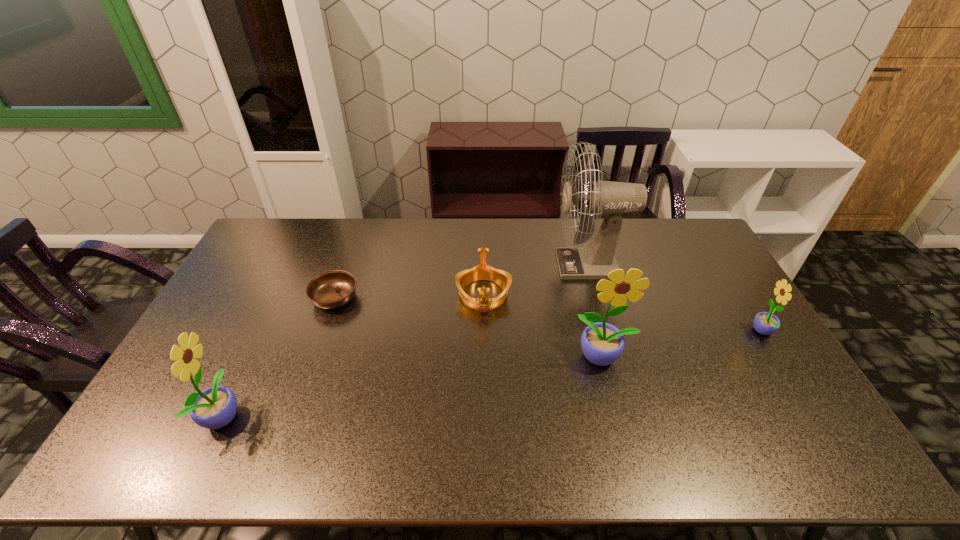
Where is `object that is at the far edge`? This screenshot has width=960, height=540. object that is at the far edge is located at coordinates (612, 199).

Locate an element on the screen. This screenshot has width=960, height=540. object that is at the near edge is located at coordinates (215, 407).

What are the coordinates of `object that is at the left edge` in the screenshot? It's located at (215, 407).

Where is `object present at the right edge`? object present at the right edge is located at coordinates (765, 323).

At what (x,y) coordinates should I click in order to perform the action: click on object located at the near left corner. Please return your answer as a coordinate pair (x, y). The height and width of the screenshot is (540, 960). Looking at the image, I should click on (215, 407).

You are a GUI agent. You are given a task and a screenshot of the screen. Output one action in this format:
    pyautogui.click(x=<x>, y=<y>)
    Task: Click on the free space at the far edge
    This screenshot has width=960, height=540.
    Given the screenshot: What is the action you would take?
    pyautogui.click(x=306, y=254)

The image size is (960, 540). I want to click on free spot at the near edge of the desktop, so click(333, 418).

In the image, there is a desktop. Identify the location of vacant area at the left edge. The height and width of the screenshot is (540, 960). (267, 272).

Locate an element on the screen. Image resolution: width=960 pixels, height=540 pixels. free space at the right edge of the desktop is located at coordinates (750, 347).

This screenshot has width=960, height=540. In the image, there is a desktop. Find the location of `free space at the near right corner`. free space at the near right corner is located at coordinates (787, 403).